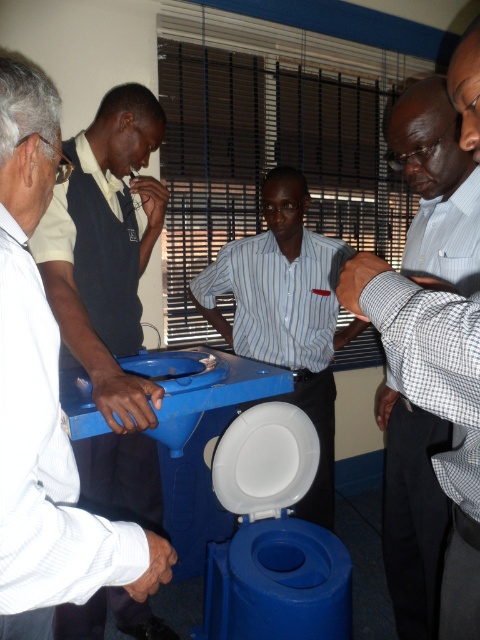
Between blue plastic toilet at left and striped cotton shirt at center, which one has more height?

With more height is striped cotton shirt at center.

Between point (55, 122) and point (219, 282), which one is positioned behind?

The point (219, 282) is behind.

Who is more distant from viewer, (22, 152) or (267, 177)?

Positioned behind is point (267, 177).

This screenshot has height=640, width=480. Identify the location of blue plastic toilet at left. tap(45, 401).

Is white checkered shirt at center thinner than striped cotton shirt at center?

Correct, white checkered shirt at center's width is less than striped cotton shirt at center's.

Measure the distance from white checkered shirt at center to striped cotton shirt at center.

white checkered shirt at center and striped cotton shirt at center are 58.55 centimeters apart from each other.

The image size is (480, 640). What do you see at coordinates (436, 186) in the screenshot?
I see `white checkered shirt at center` at bounding box center [436, 186].

What are the coordinates of `white checkered shirt at center` in the screenshot? It's located at (436, 186).

Is blue plastic toilet at left positioned at the back of white checkered shirt at center?

No.

Does blue plastic toilet at left have a larger size compared to white checkered shirt at center?

Yes.

At what (x,y) coordinates should I click in order to perform the action: click on blue plastic toilet at left. Please return your answer as a coordinate pair (x, y). The width and height of the screenshot is (480, 640). Looking at the image, I should click on (45, 401).